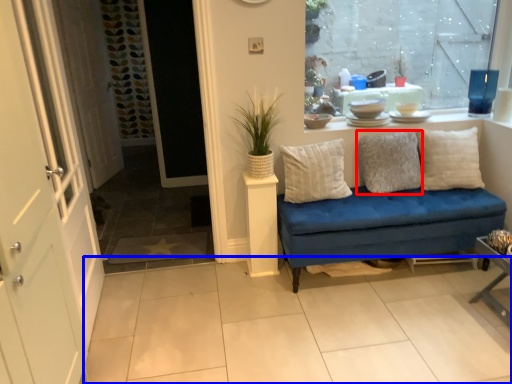
Question: Which of the following is the closest to the observer, pillow (highlighted by a red box) or tile (highlighted by a blue box)?

Choices:
 (A) pillow
 (B) tile

Answer: (B)